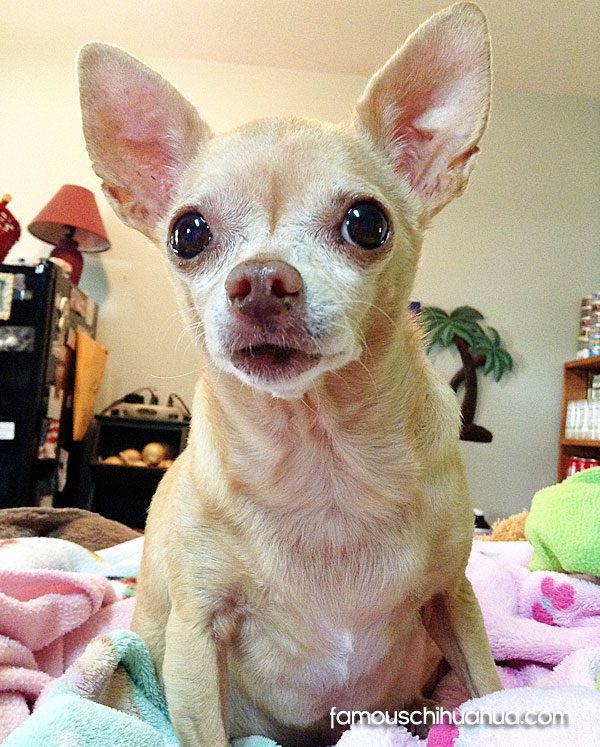
Locate an element on the screen. The width and height of the screenshot is (600, 747). blanket is located at coordinates (60, 595).